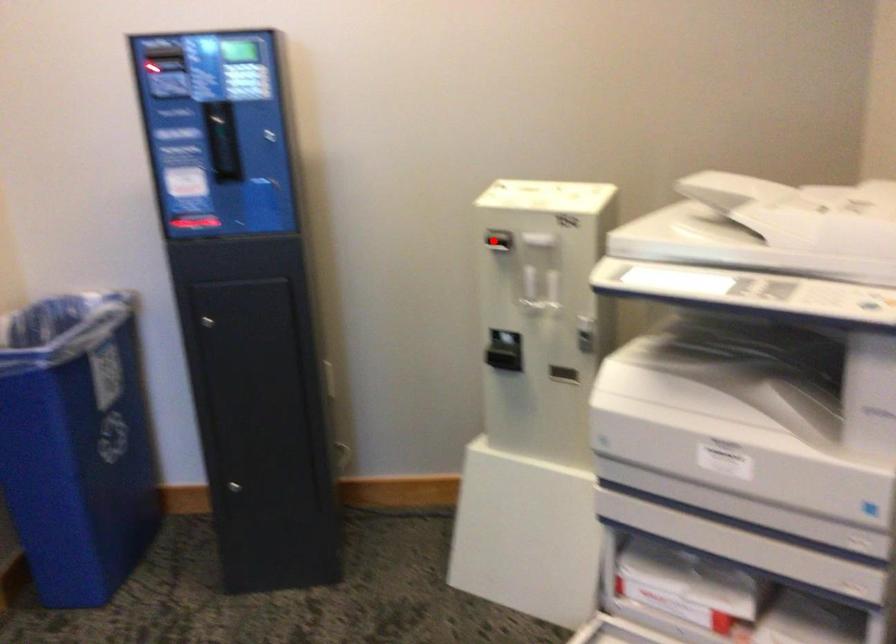
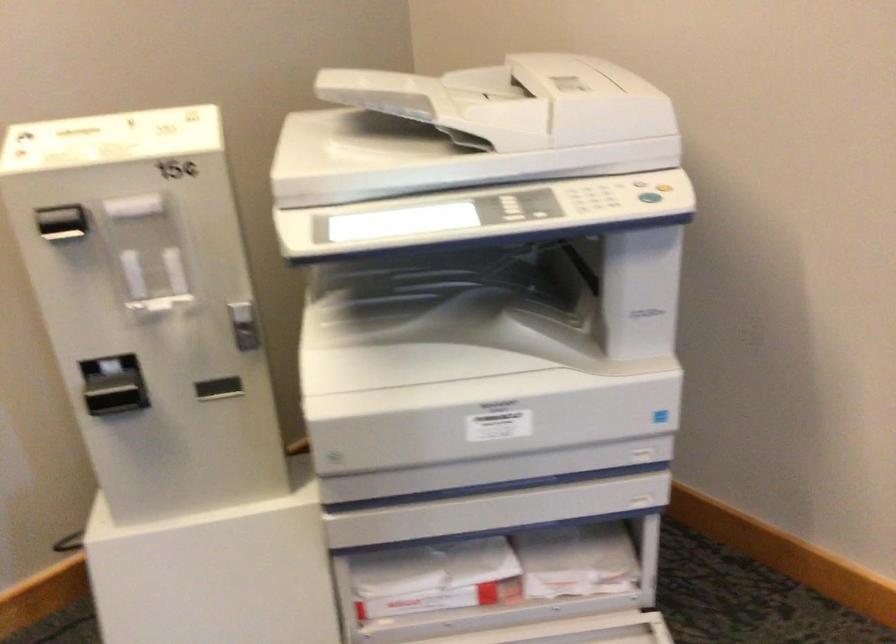
Where in the second image is the point corresponding to the highlighted location from the first image?

(62, 223)